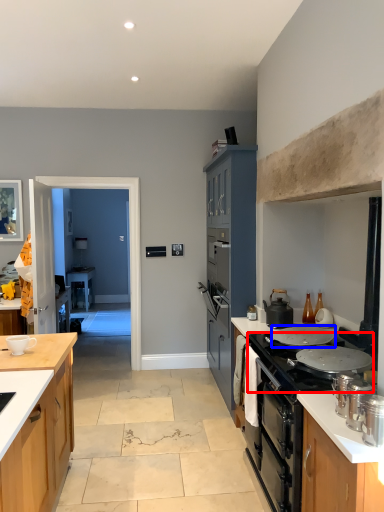
Question: Which object appears farthest to the camera in this image, gas stove (highlighted by a red box) or pot/pan (highlighted by a blue box)?

Choices:
 (A) gas stove
 (B) pot/pan

Answer: (B)